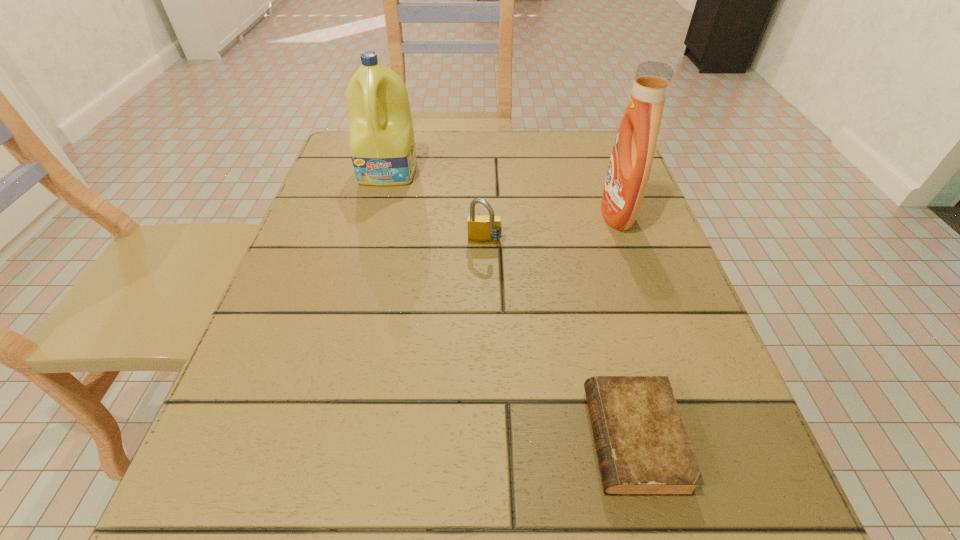
Locate an element on the screen. the nearer detergent is located at coordinates (629, 169).

At what (x,y) coordinates should I click in order to perform the action: click on the farthest object. Please return your answer as a coordinate pair (x, y). The width and height of the screenshot is (960, 540). Looking at the image, I should click on (382, 147).

You are a GUI agent. You are given a task and a screenshot of the screen. Output one action in this format:
    pyautogui.click(x=<x>, y=<y>)
    Task: Click on the farther detergent
    The height and width of the screenshot is (540, 960).
    Given the screenshot: What is the action you would take?
    pyautogui.click(x=382, y=147)

Where is `padlock`? The image size is (960, 540). padlock is located at coordinates (483, 229).

Image resolution: width=960 pixels, height=540 pixels. What are the coordinates of `the third tallest object` in the screenshot? It's located at (483, 229).

What are the coordinates of `diary` in the screenshot? It's located at (643, 449).

Locate an element on the screen. This screenshot has height=540, width=960. the shortest object is located at coordinates 643,449.

Where is `vacant region located 0.370m on the front-facing side of the right detergent`? This screenshot has width=960, height=540. vacant region located 0.370m on the front-facing side of the right detergent is located at coordinates (423, 214).

Where is `vacant space situated on the front-facing side of the right detergent`? This screenshot has height=540, width=960. vacant space situated on the front-facing side of the right detergent is located at coordinates (414, 214).

Where is `vacant space located on the front-facing side of the right detergent`? This screenshot has height=540, width=960. vacant space located on the front-facing side of the right detergent is located at coordinates (577, 214).